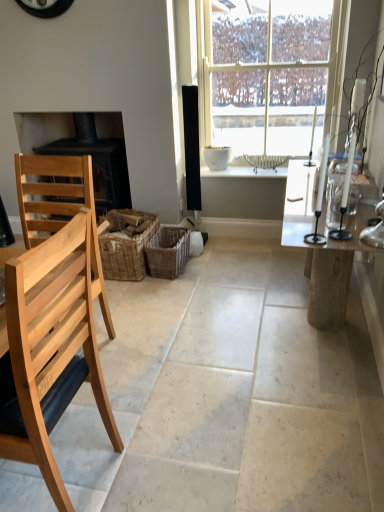
Identify the location of free point below white wicker basket at center (from a real-world perspective). (262, 170).